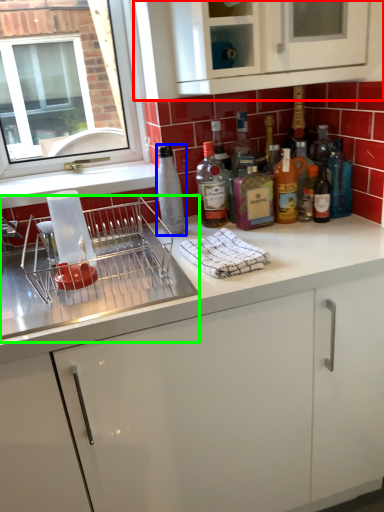
Question: Which object is positioned closest to cabinetry (highlighted by a red box)? Select from bottle (highlighted by a blue box) and appliance (highlighted by a green box).

Choices:
 (A) bottle
 (B) appliance

Answer: (A)